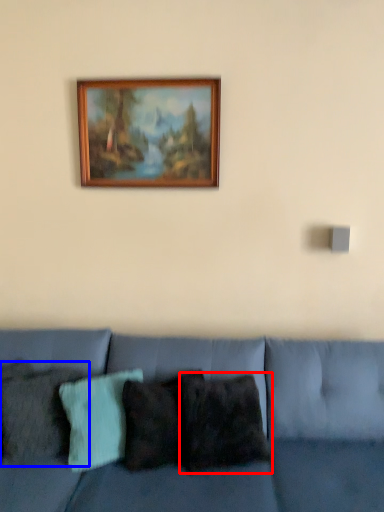
Question: Which object appears closest to the camera in this image, pillow (highlighted by a red box) or pillow (highlighted by a blue box)?

Choices:
 (A) pillow
 (B) pillow

Answer: (B)